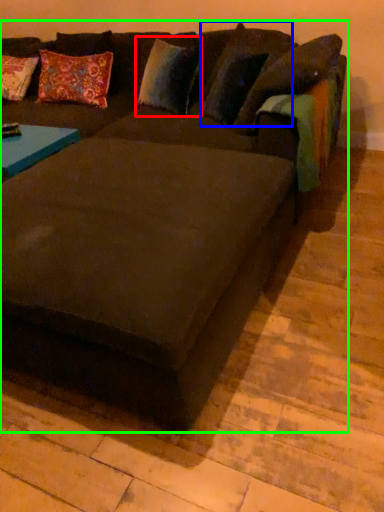
Question: Which is nearer to the pillow (highlighted by a red box)? pillow (highlighted by a blue box) or studio couch (highlighted by a green box).

Choices:
 (A) pillow
 (B) studio couch

Answer: (A)